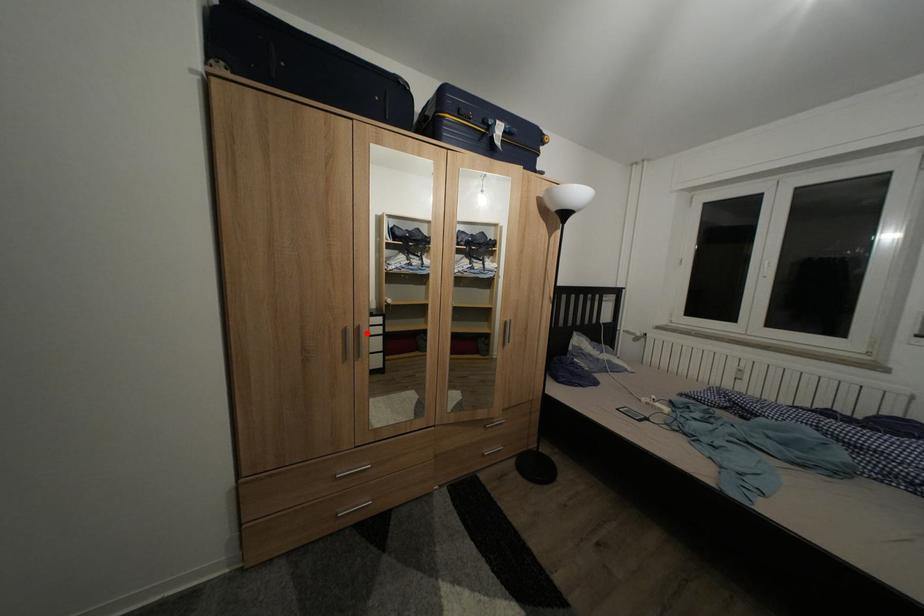
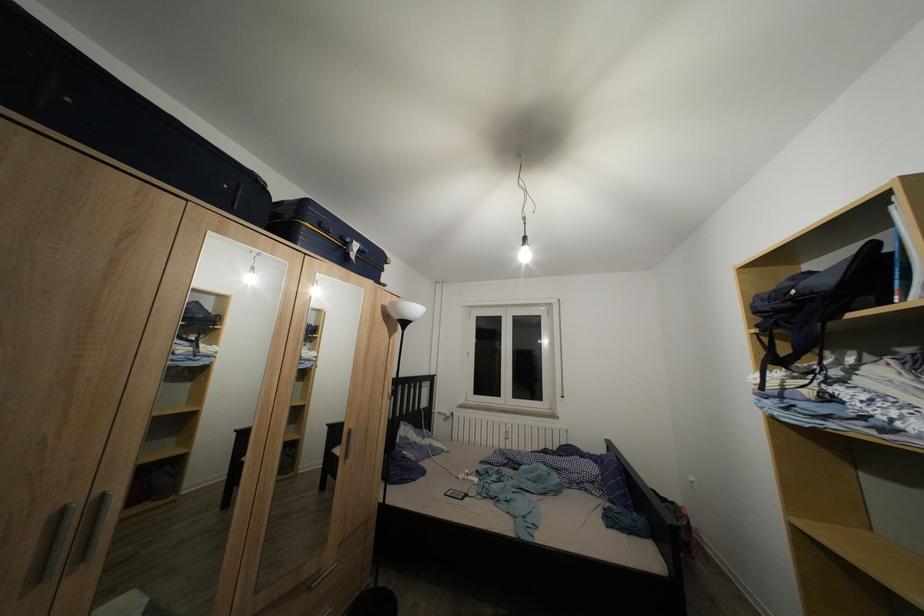
Question: I am providing you with two images of the same scene from different viewpoints. Image1 has a red point marked. In image2, the corresponding 3D location appears at what relative position? Reply with the corresponding letter.

Choices:
 (A) Closer
 (B) Farther

Answer: (B)